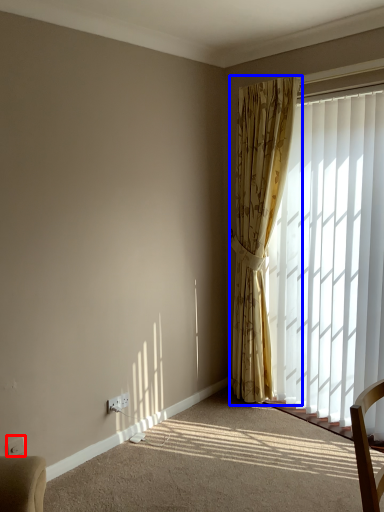
Question: Which object is further to the camera taking this photo, electric outlet (highlighted by a red box) or curtain (highlighted by a blue box)?

Choices:
 (A) electric outlet
 (B) curtain

Answer: (B)